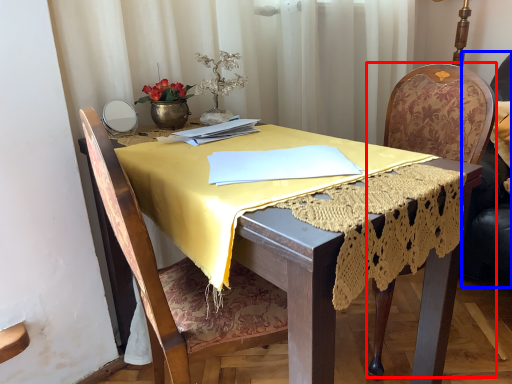
Question: Which object appears farthest to the camera in this image, chair (highlighted by a red box) or swivel chair (highlighted by a blue box)?

Choices:
 (A) chair
 (B) swivel chair

Answer: (B)